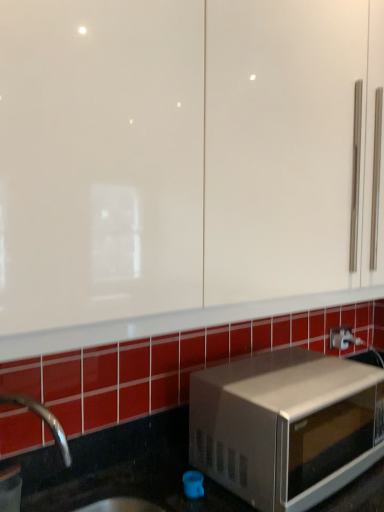
Image resolution: width=384 pixels, height=512 pixels. Describe the element at coordinates (286, 426) in the screenshot. I see `satin silver microwave at lower right` at that location.

Locate an element on the screen. satin silver microwave at lower right is located at coordinates (286, 426).

Locate an element on the screen. The height and width of the screenshot is (512, 384). satin silver microwave at lower right is located at coordinates (286, 426).